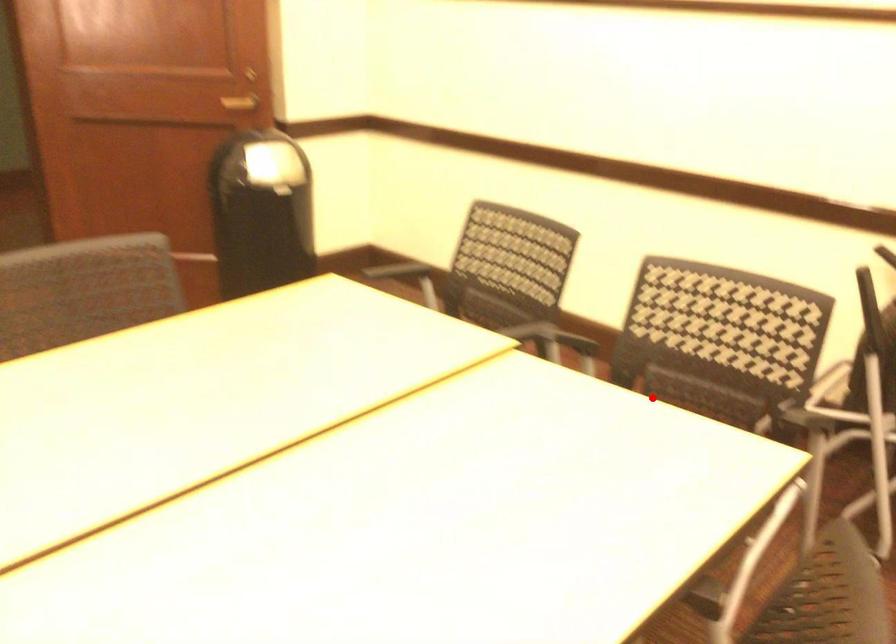
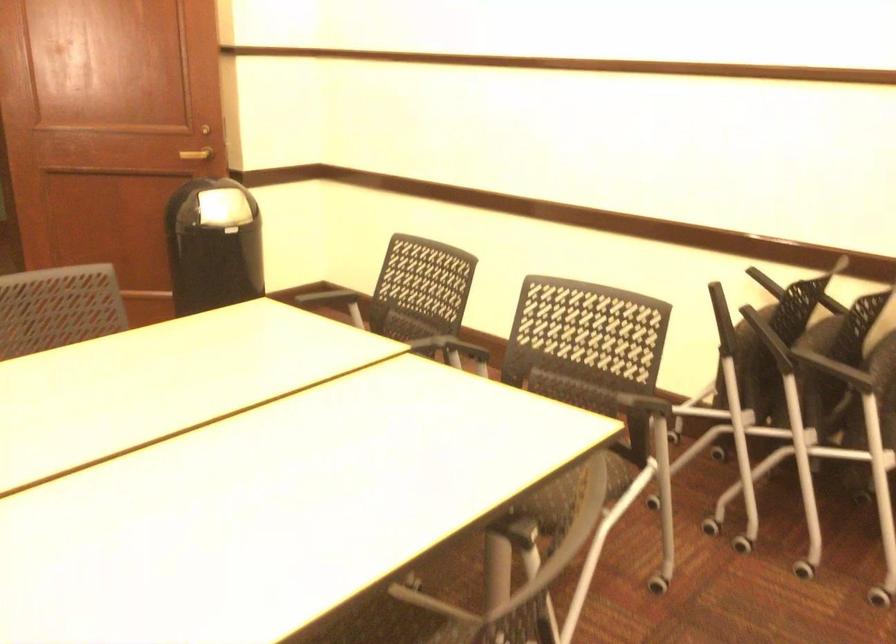
Question: I am providing you with two images of the same scene from different viewpoints. A red point is marked on the first image. At the location where the point appears in image 1, is it still visible in image 2?

Choices:
 (A) Yes
 (B) No

Answer: (B)